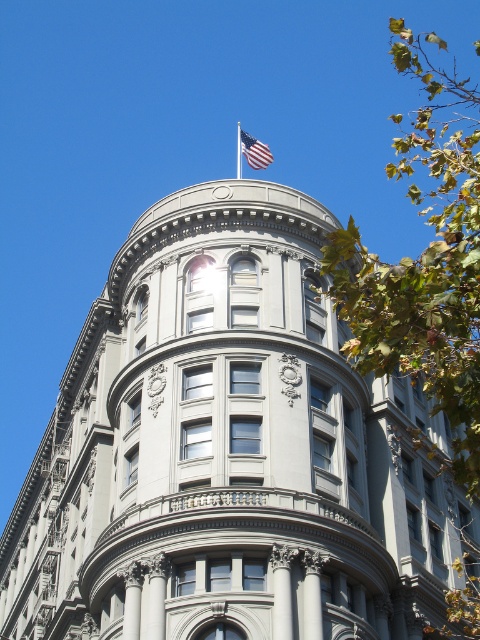
Measure the distance from gray stone tower at center to american flag at top.

119.78 feet

Is point (312, 461) positioned behind point (243, 148)?

No.

Identify the location of gray stone tower at center. This screenshot has width=480, height=640. [228, 451].

Image resolution: width=480 pixels, height=640 pixels. What do you see at coordinates (228, 451) in the screenshot? I see `gray stone tower at center` at bounding box center [228, 451].

Which is above, gray stone tower at center or silver metallic flag pole at upper center?

Positioned higher is silver metallic flag pole at upper center.

Find the location of a particular element. This screenshot has height=640, width=480. gray stone tower at center is located at coordinates (228, 451).

Image resolution: width=480 pixels, height=640 pixels. Identify the location of gray stone tower at center. (228, 451).

Which is below, american flag at top or silver metallic flag pole at upper center?

american flag at top is lower down.

Which is in front, point (253, 150) or point (241, 148)?

Point (253, 150) is in front.

Which is in front, point (244, 134) or point (239, 132)?

Point (244, 134)

In order to click on american flag at top in this screenshot , I will do `click(254, 150)`.